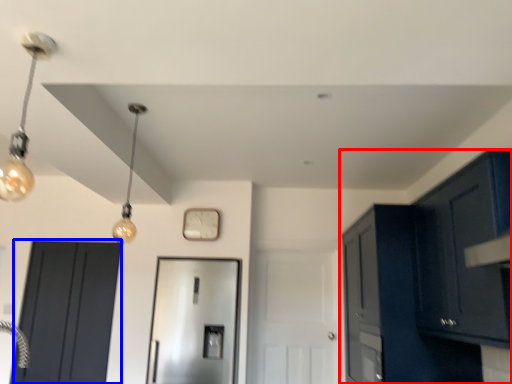
Question: Among these objects, which one is nearest to the camera, cabinetry (highlighted by a red box) or door (highlighted by a blue box)?

Choices:
 (A) cabinetry
 (B) door

Answer: (A)